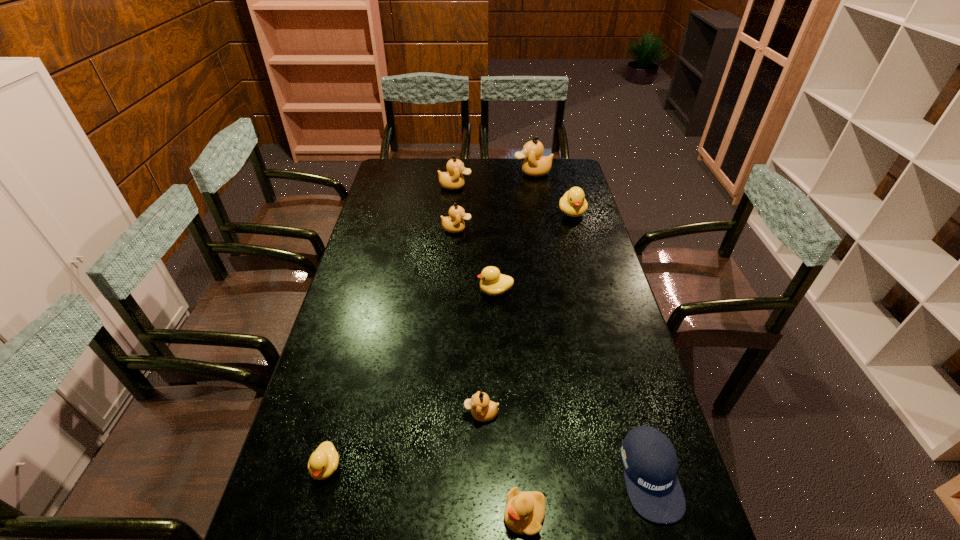
Where is `free spot between the leftmost yellow duckling and the second nearest tan duckling`? The image size is (960, 540). free spot between the leftmost yellow duckling and the second nearest tan duckling is located at coordinates (391, 348).

Identify the location of free spot between the nearest duckling and the tallest duckling. (529, 343).

Where is `blank region between the blue baseball cap and the nearest yellow duckling`? This screenshot has width=960, height=540. blank region between the blue baseball cap and the nearest yellow duckling is located at coordinates (588, 495).

Locate an element on the screen. This screenshot has width=960, height=540. vacant point located between the sixth farthest object and the second tallest object is located at coordinates (468, 300).

Locate an element on the screen. free area in between the rightmost yellow duckling and the second farthest object is located at coordinates (514, 199).

At what (x,y) coordinates should I click in order to perform the action: click on vacant region between the nearest yellow duckling and the tallest duckling. Please return your answer as a coordinate pair (x, y). The height and width of the screenshot is (540, 960). Looking at the image, I should click on (529, 343).

At what (x,y) coordinates should I click in order to perform the action: click on empty space between the baseball cap and the third farthest tan duckling. Please return your answer as a coordinate pair (x, y). The height and width of the screenshot is (540, 960). Looking at the image, I should click on tap(553, 352).

Point out which object is positioned as the fourth nearest to the baseball cap. Please provide its 2D coordinates. Your answer should be formatted as a tuple, i.e. [(x, y)], where the tuple contains the x and y coordinates of a point satisfying the conditions above.

[(324, 460)]

This screenshot has height=540, width=960. Identify the location of the second closest object to the baseball cap. (483, 409).

Locate which duckling ranks fifth in proximity to the leftmost yellow duckling. Please provide its 2D coordinates. Your answer should be formatted as a tuple, i.e. [(x, y)], where the tuple contains the x and y coordinates of a point satisfying the conditions above.

[(573, 203)]